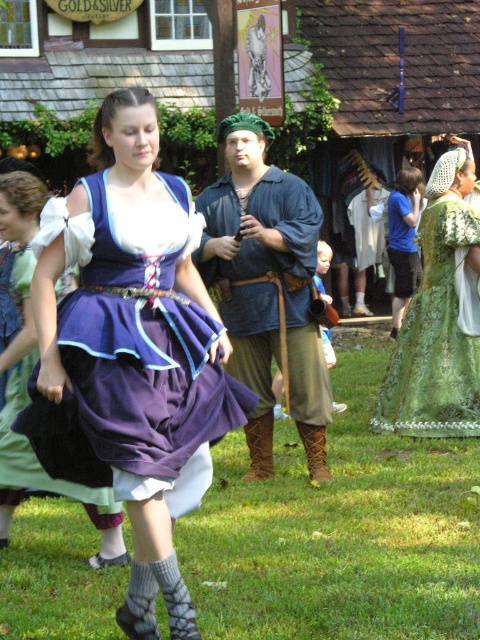
Is point (217, 232) positioned in front of point (408, 228)?

That is True.

Is point (239, 372) farther from camera compared to point (409, 204)?

That is False.

Is point (275, 339) positioned after point (402, 278)?

That is False.

Image resolution: width=480 pixels, height=640 pixels. Identify the location of blue cotton shirt at center. (268, 289).

Can you confirm if green textured fabric dress at center is positioned to the right of matte purple dress at center?

Correct, you'll find green textured fabric dress at center to the right of matte purple dress at center.

Which is behind, point (411, 433) or point (24, 401)?

Positioned behind is point (411, 433).

Image resolution: width=480 pixels, height=640 pixels. What are the coordinates of `green textured fabric dress at center` in the screenshot? It's located at (435, 336).

The width and height of the screenshot is (480, 640). What are the coordinates of `green textured fabric dress at center` in the screenshot? It's located at (435, 336).

Which is in front, point (76, 568) or point (406, 396)?

Positioned in front is point (76, 568).

Is point (384, 612) more distant than point (472, 285)?

No, (384, 612) is in front of (472, 285).

Which is behind, point (380, 500) or point (394, 396)?

The point (394, 396) is more distant.

Locate an element on the screen. green grass at lower center is located at coordinates (339, 532).